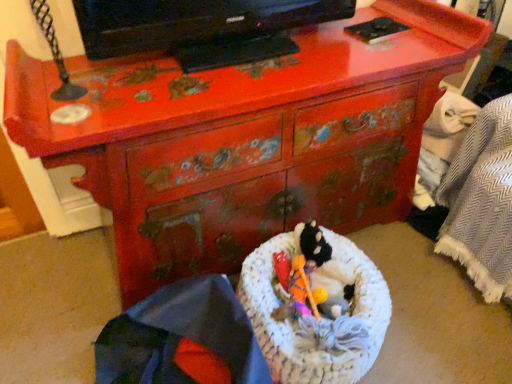
Question: Does woven fabric basket at lower center have a lesser width compared to white knitted laundry basket at center?

Choices:
 (A) yes
 (B) no

Answer: (B)

Question: Considering the relative sizes of woven fabric basket at lower center and white knitted laundry basket at center in the image provided, is woven fabric basket at lower center shorter than white knitted laundry basket at center?

Choices:
 (A) yes
 (B) no

Answer: (B)

Question: From the image's perspective, is woven fabric basket at lower center located above white knitted laundry basket at center?

Choices:
 (A) no
 (B) yes

Answer: (A)

Question: Considering the relative sizes of woven fabric basket at lower center and white knitted laundry basket at center in the image provided, is woven fabric basket at lower center bigger than white knitted laundry basket at center?

Choices:
 (A) no
 (B) yes

Answer: (B)

Question: Is woven fabric basket at lower center positioned with its back to white knitted laundry basket at center?

Choices:
 (A) yes
 (B) no

Answer: (A)

Question: Does woven fabric basket at lower center appear on the left side of white knitted laundry basket at center?

Choices:
 (A) no
 (B) yes

Answer: (B)

Question: Could you tell me if white knitted laundry basket at center is facing black glossy tv at upper center?

Choices:
 (A) yes
 (B) no

Answer: (B)

Question: Is there a large distance between white knitted laundry basket at center and black glossy tv at upper center?

Choices:
 (A) yes
 (B) no

Answer: (B)

Question: From the image's perspective, is white knitted laundry basket at center over black glossy tv at upper center?

Choices:
 (A) no
 (B) yes

Answer: (A)

Question: From a real-world perspective, is white knitted laundry basket at center positioned under black glossy tv at upper center based on gravity?

Choices:
 (A) yes
 (B) no

Answer: (A)

Question: Can you confirm if white knitted laundry basket at center is taller than black glossy tv at upper center?

Choices:
 (A) no
 (B) yes

Answer: (A)

Question: Is white knitted laundry basket at center shorter than black glossy tv at upper center?

Choices:
 (A) no
 (B) yes

Answer: (B)

Question: From a real-world perspective, does black glossy tv at upper center stand above white knitted laundry basket at center?

Choices:
 (A) no
 (B) yes

Answer: (B)